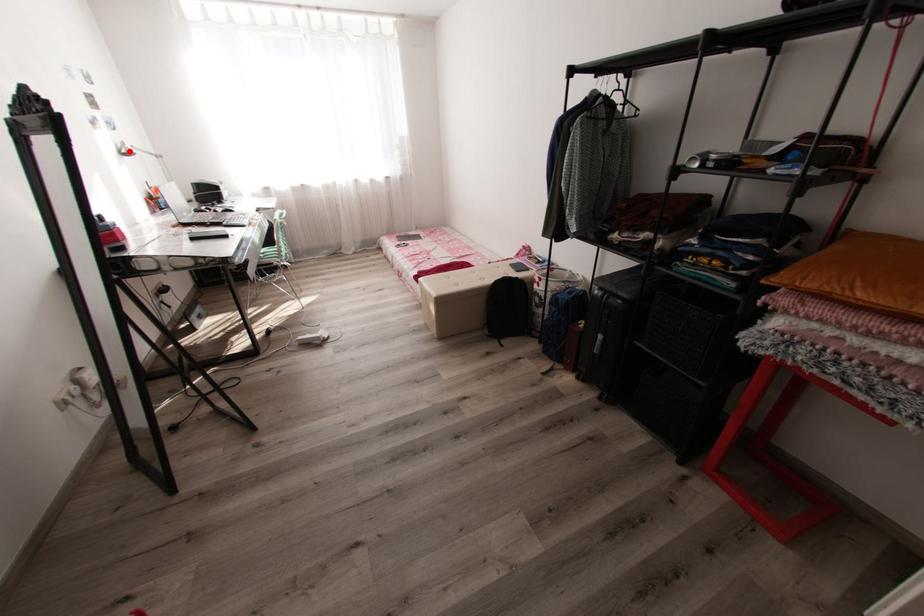
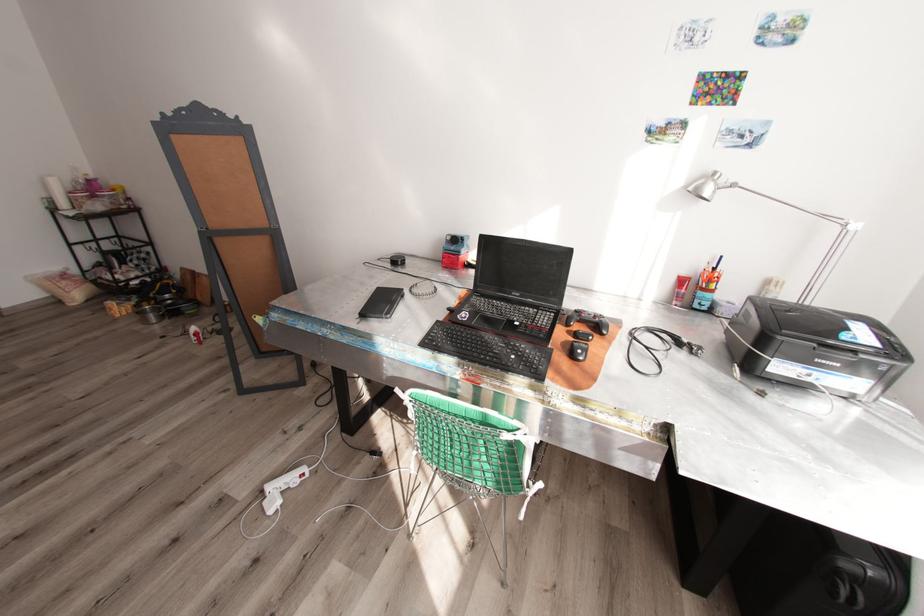
The point at the highlighted location is marked in the first image. Where is the corresponding point in the second image?

(695, 188)